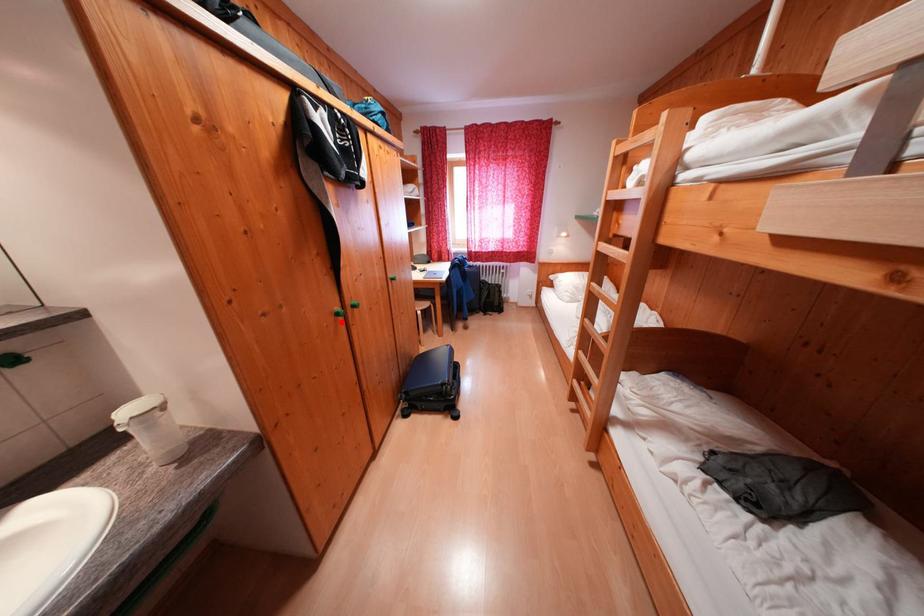
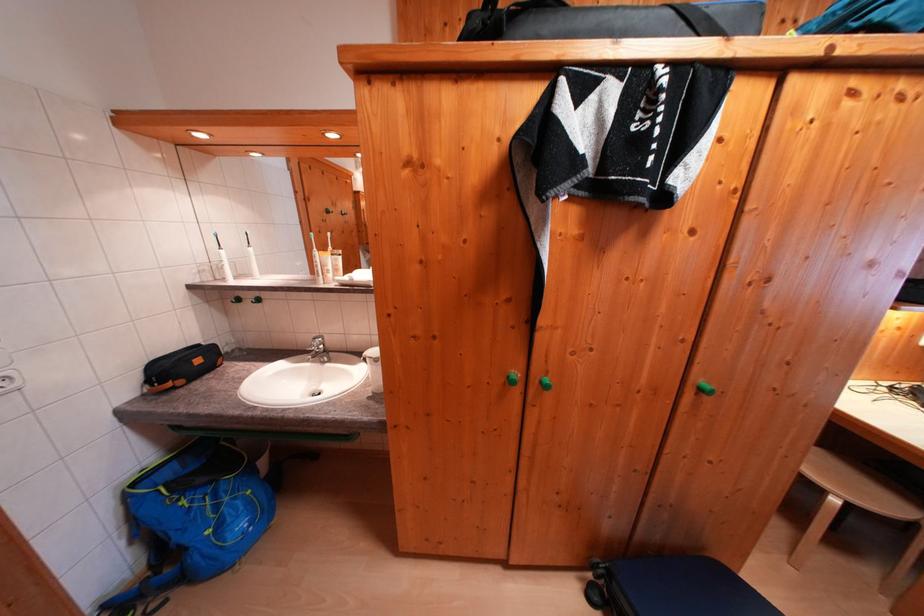
Question: I am providing you with two images of the same scene from different viewpoints. Image1 has a red point marked. In image2, the corresponding 3D location appears at what relative position? Reply with the corresponding letter.

Choices:
 (A) Closer
 (B) Farther

Answer: (B)